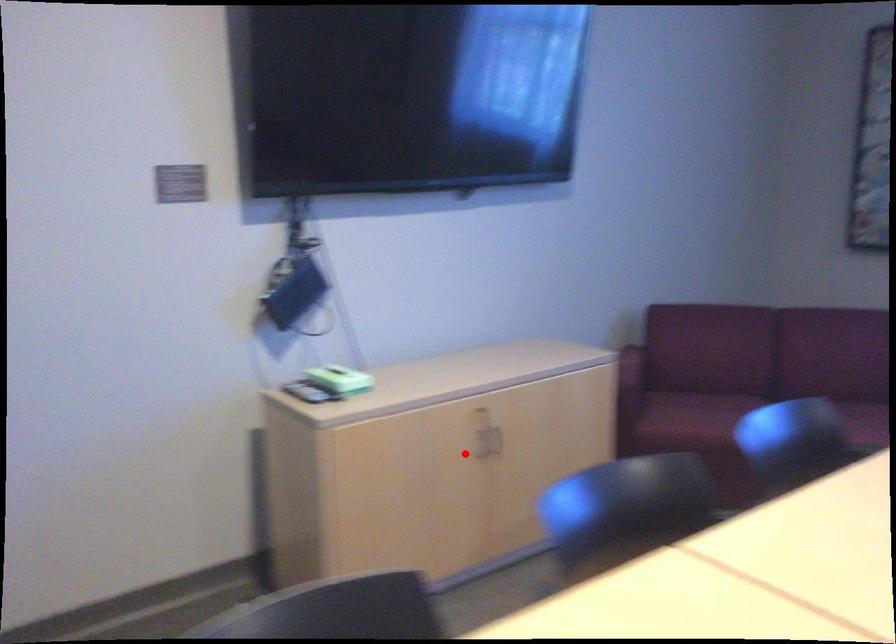
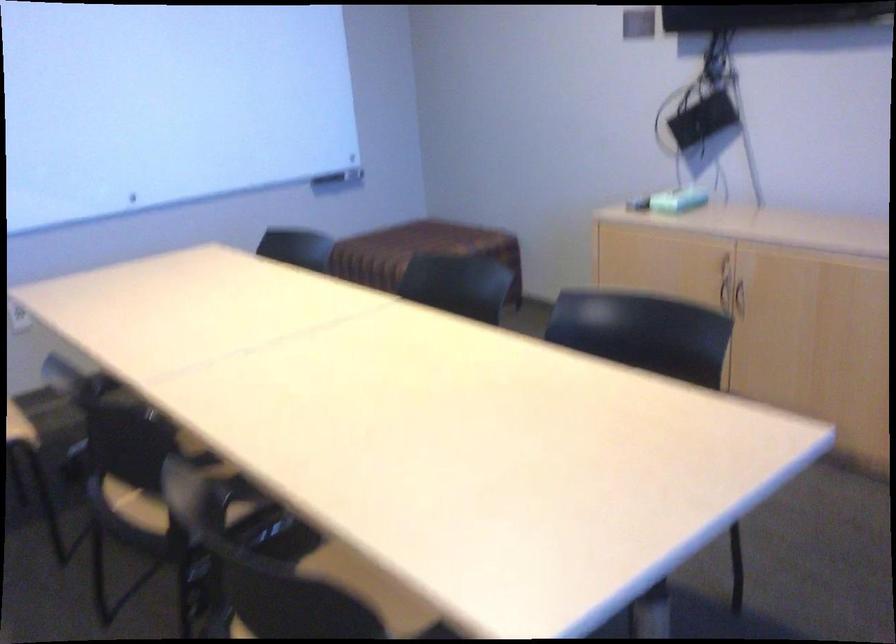
Find the pixel in the second image that matches the highlighted location in the first image.

(725, 295)